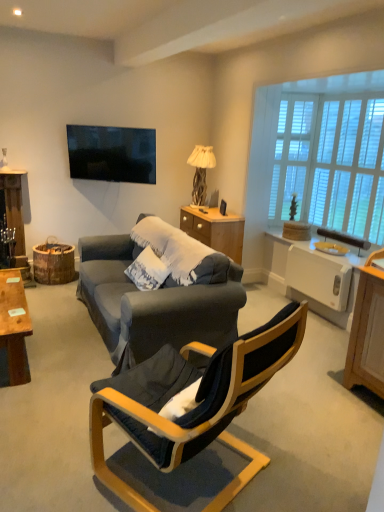
Locate an element on the screen. The height and width of the screenshot is (512, 384). free spot to the left of velvet dark blue chair at center is located at coordinates (57, 446).